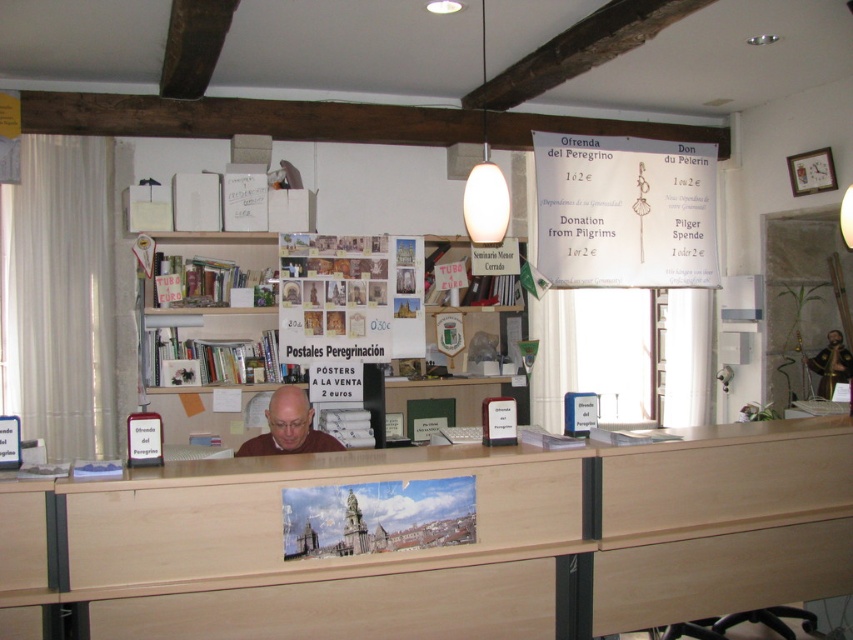
Question: Is wooden drawer at lower left further to camera compared to matte gray head at center?

Choices:
 (A) yes
 (B) no

Answer: (B)

Question: Which point is farther to the camera?

Choices:
 (A) wooden drawer at lower left
 (B) wooden drawer at center
 (C) light wood drawer at lower right
 (D) matte gray head at center

Answer: (D)

Question: Does wooden drawer at center have a lesser width compared to matte gray head at center?

Choices:
 (A) no
 (B) yes

Answer: (A)

Question: Which object is positioned farthest from the wooden bookshelf at center?

Choices:
 (A) matte gray head at center
 (B) light wood drawer at lower right

Answer: (B)

Question: From the image, what is the correct spatial relationship of light wood drawer at lower right in relation to matte gray head at center?

Choices:
 (A) right
 (B) left

Answer: (A)

Question: Which point is farther from the camera taking this photo?

Choices:
 (A) (547, 544)
 (B) (267, 436)
 (C) (296, 294)
 (D) (692, 253)

Answer: (D)